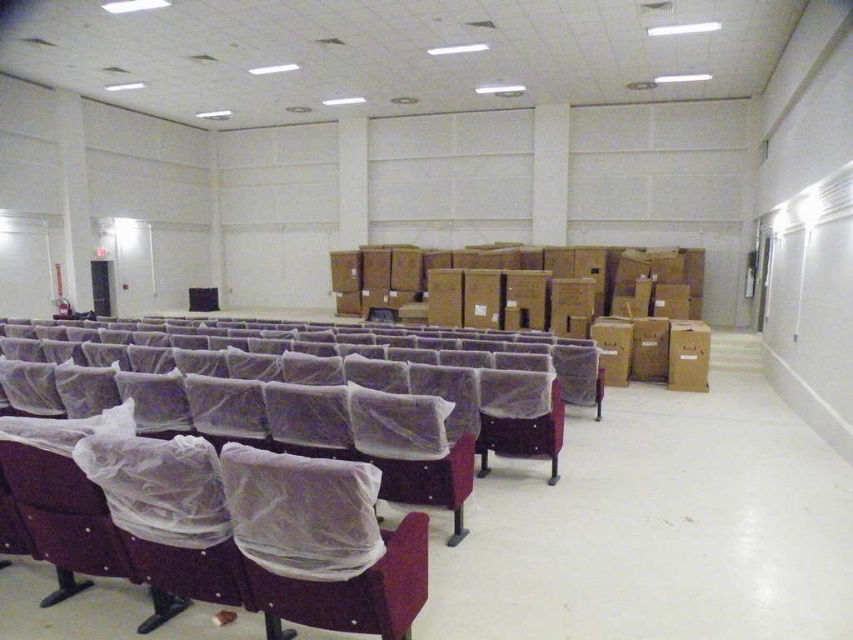
Between matte purple chair at left and clear plastic chair at center, which one is positioned higher?

matte purple chair at left

Does matte purple chair at left have a smaller size compared to clear plastic chair at center?

Actually, matte purple chair at left might be larger than clear plastic chair at center.

What do you see at coordinates (252, 474) in the screenshot?
I see `matte purple chair at left` at bounding box center [252, 474].

Locate an element on the screen. The width and height of the screenshot is (853, 640). matte purple chair at left is located at coordinates (252, 474).

Does matte plastic chair at center have a larger size compared to clear plastic chair at center?

Yes.

Which is in front, point (370, 497) or point (364, 394)?

Positioned in front is point (370, 497).

Where is `matte plastic chair at center`? This screenshot has width=853, height=640. matte plastic chair at center is located at coordinates (323, 541).

Can you confirm if matte purple chair at left is positioned to the left of matte plastic chair at center?

Correct, you'll find matte purple chair at left to the left of matte plastic chair at center.

This screenshot has height=640, width=853. Describe the element at coordinates (252, 474) in the screenshot. I see `matte purple chair at left` at that location.

Describe the element at coordinates (252, 474) in the screenshot. I see `matte purple chair at left` at that location.

Where is `matte purple chair at left`? matte purple chair at left is located at coordinates (252, 474).